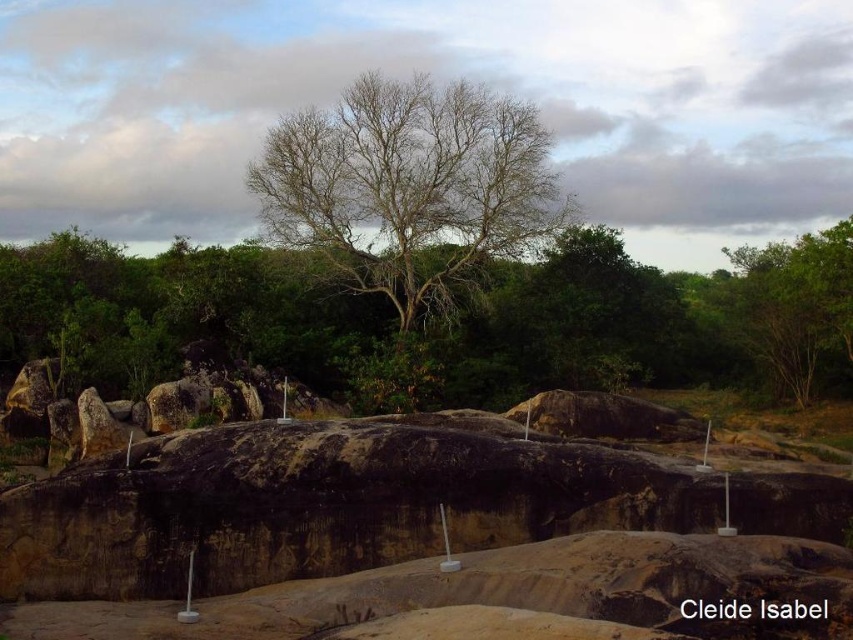
You are a bird looking for a nesting spot. You see the bare branches at center and the green leafy tree at upper right. Which tree would you choose if you prefer nesting in taller trees?

The bare branches at center is taller than the green leafy tree at upper right, so the bird would choose the bare branches at center for nesting.

You are standing at the origin point in the center of the image. You want to walk towards point A located at point (247, 182) and point B located at point (749, 320). Which point will you reach first?

You will reach point B located at point (749, 320) first because point A located at point (247, 182) is behind it.

Looking at this image, you are a hiker standing at the base of the tree with bare branches at center. If you want to reach the point marked at coordinates 0.311, 0.482, which direction should you walk relative to the tree?

The point (410, 198) corresponds to the position of the bare branches at center, so you are already at that location.